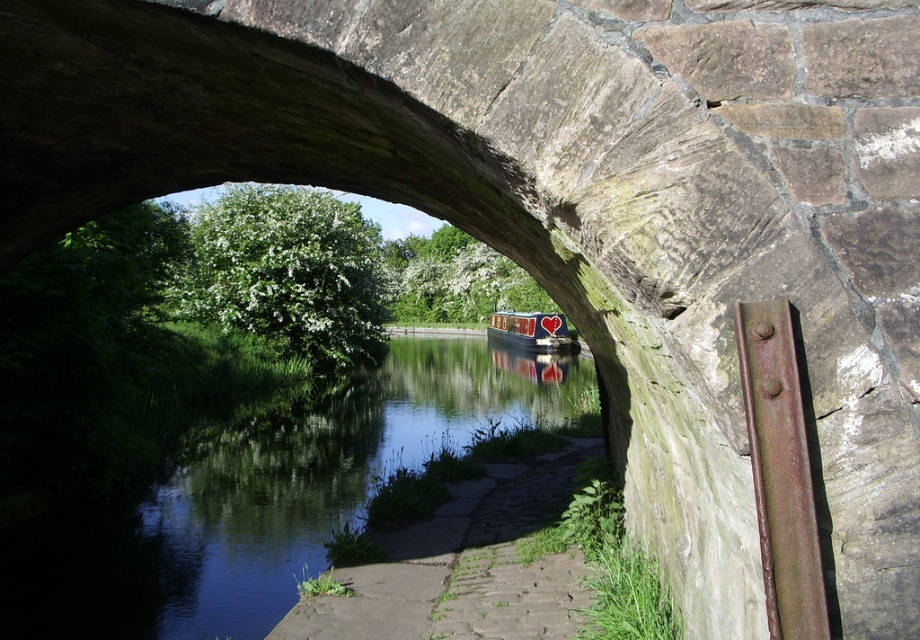
Looking at this image, can you confirm if green smooth water at center is positioned below matte red canal boat at center?

Yes.

Does point (585, 388) come closer to viewer compared to point (553, 321)?

That is True.

Find the location of `green smooth water at center`. green smooth water at center is located at coordinates (267, 497).

Does green smooth water at center appear on the left side of rusty metal rail at right?

Yes, green smooth water at center is to the left of rusty metal rail at right.

Which is behind, point (145, 624) or point (777, 522)?

Positioned behind is point (145, 624).

Who is more distant from viewer, (273, 548) or (798, 534)?

The point (273, 548) is more distant.

Find the location of `green smooth water at center`. green smooth water at center is located at coordinates (267, 497).

Measure the distance between rusty metal rail at right and matte red canal boat at center.

A distance of 166.13 feet exists between rusty metal rail at right and matte red canal boat at center.

Which is more to the left, rusty metal rail at right or matte red canal boat at center?

rusty metal rail at right is more to the left.

Is point (801, 600) less distant than point (493, 326)?

That is True.

At what (x,y) coordinates should I click in order to perform the action: click on rusty metal rail at right. Please return your answer as a coordinate pair (x, y). The width and height of the screenshot is (920, 640). Looking at the image, I should click on (780, 470).